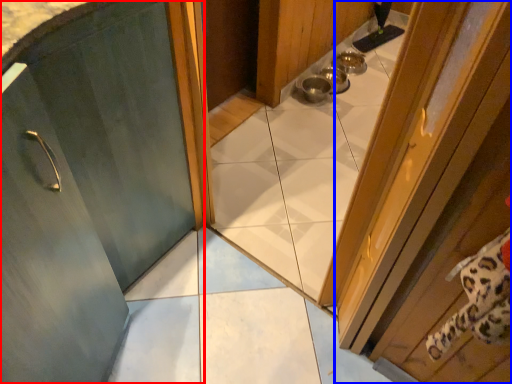
Question: Which object is closer to the camera taking this photo, door (highlighted by a red box) or door (highlighted by a blue box)?

Choices:
 (A) door
 (B) door

Answer: (B)